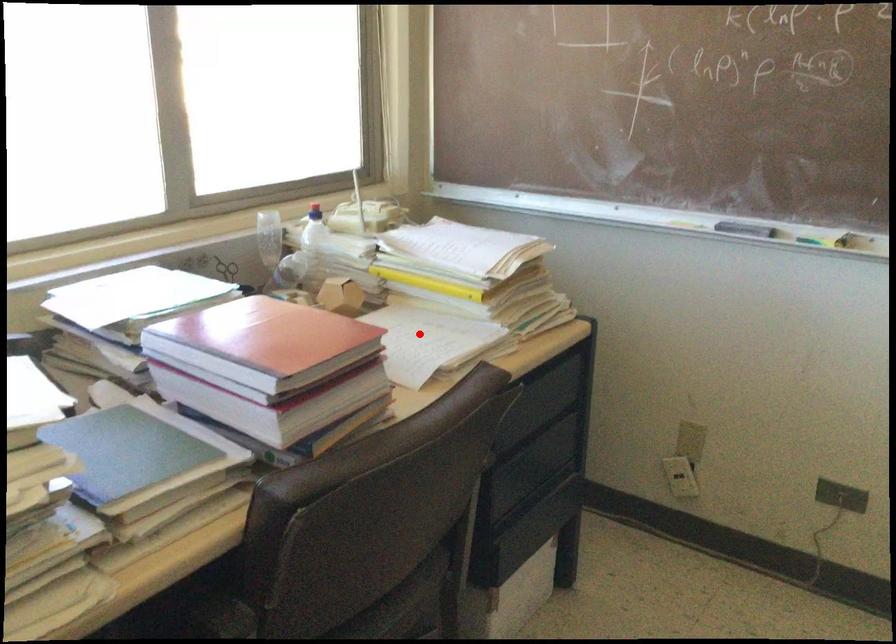
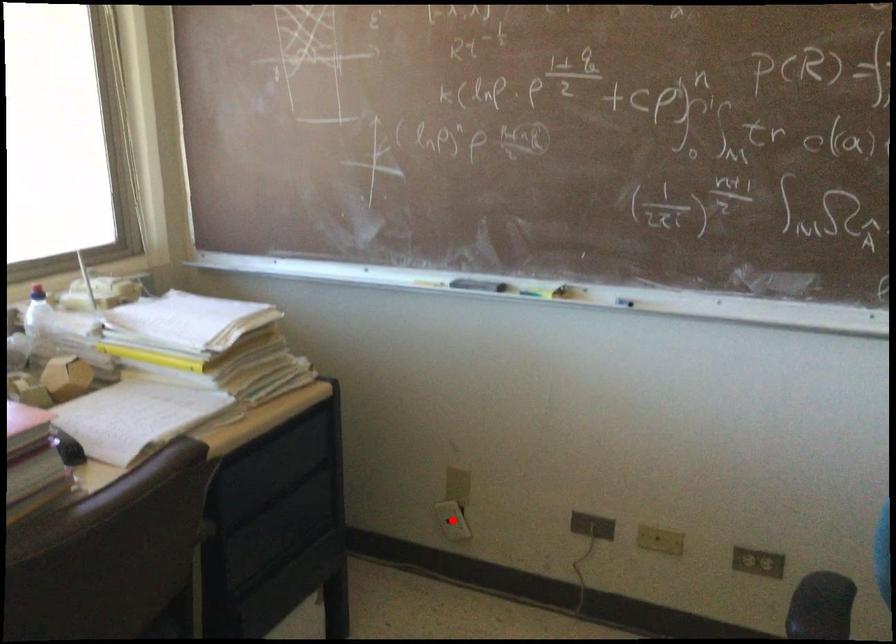
I am providing you with two images of the same scene from different viewpoints. A red point is marked on the first image and another point is marked on the second image. Are the points marked in image1 and image2 representing the same 3D position?

No